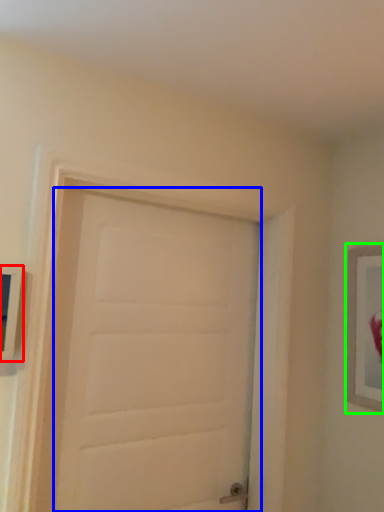
Question: Which is farther away from picture frame (highlighted by a red box)? door (highlighted by a blue box) or picture frame (highlighted by a green box)?

Choices:
 (A) door
 (B) picture frame

Answer: (B)